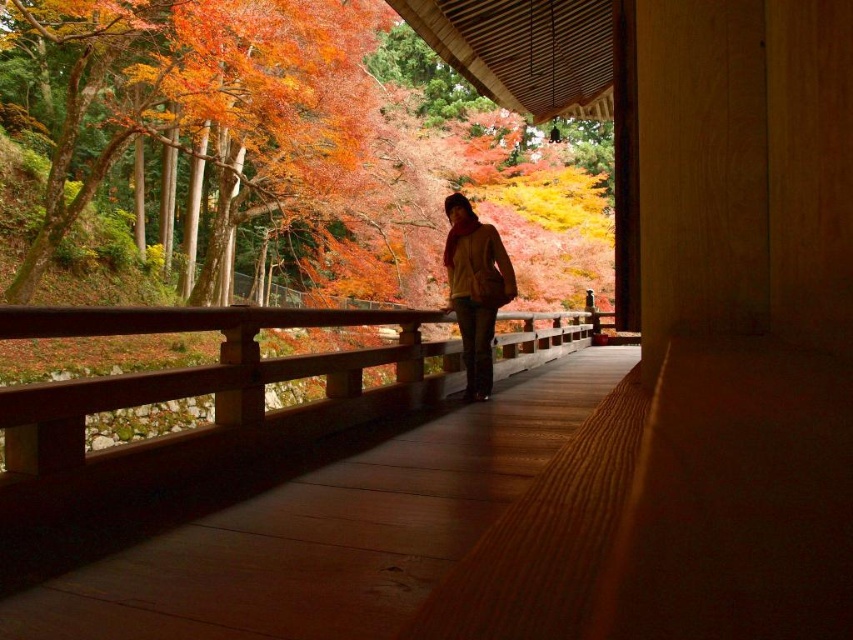
Does point (491, 336) come farther from viewer compared to point (465, 236)?

Yes, point (491, 336) is behind point (465, 236).

Is matte yellow sweater at center positioned at the back of matte yellow jacket at center?

That is False.

The height and width of the screenshot is (640, 853). I want to click on matte yellow sweater at center, so click(474, 289).

Is autumn leaves at upper left taller than matte yellow sweater at center?

Yes, autumn leaves at upper left is taller than matte yellow sweater at center.

Identify the location of autumn leaves at upper left. pos(524,51).

Describe the element at coordinates (524, 51) in the screenshot. This screenshot has width=853, height=640. I see `autumn leaves at upper left` at that location.

This screenshot has width=853, height=640. Find the location of `autumn leaves at upper left`. autumn leaves at upper left is located at coordinates (524, 51).

Can you confirm if wooden walkway at center is bigger than matte yellow jacket at center?

Actually, wooden walkway at center might be smaller than matte yellow jacket at center.

In order to click on wooden walkway at center in this screenshot , I will do `click(316, 531)`.

This screenshot has height=640, width=853. In order to click on wooden walkway at center in this screenshot , I will do `click(316, 531)`.